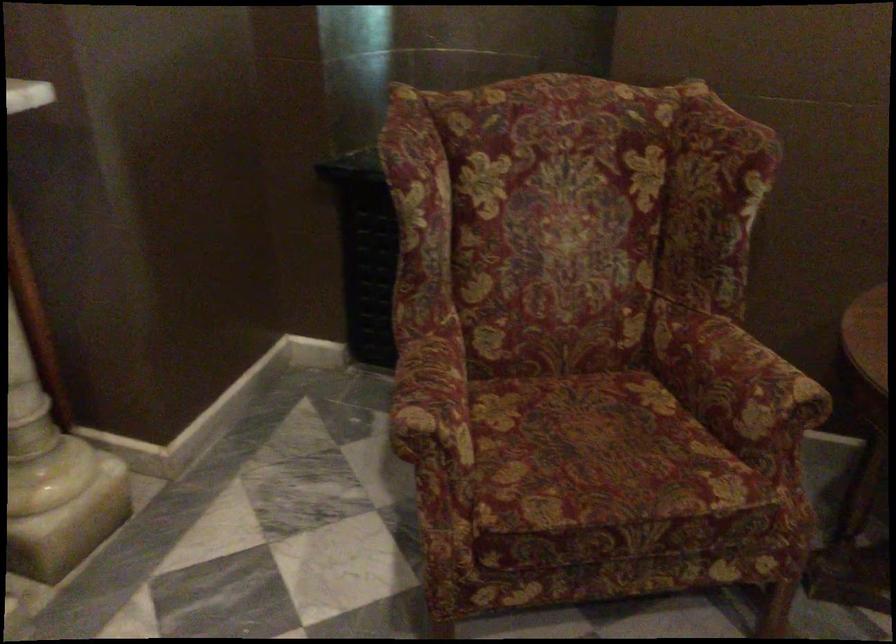
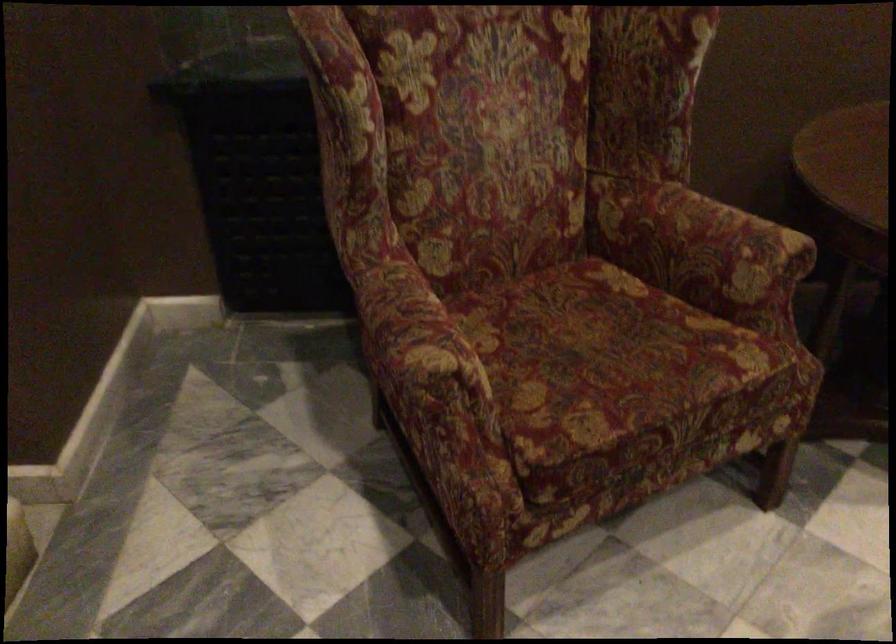
In the second image, find the point that corresponds to (x=726, y=375) in the first image.

(700, 243)